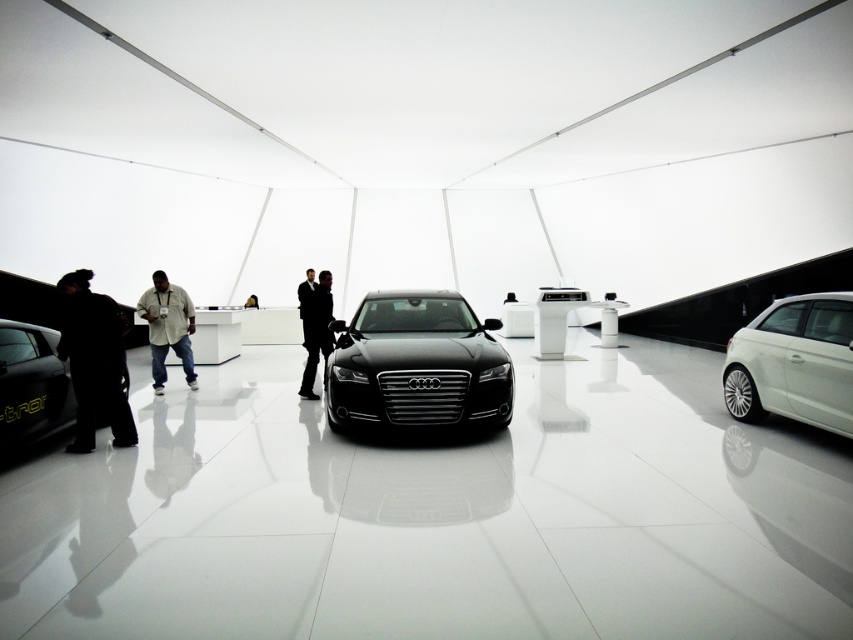
You are a delivery person trying to park your van in the showroom. The van requires a space that is at least 2 meters tall to accommodate its height. Based on the image, which car between the white metallic hatchback at right and the matte black car at lower left would you consider when assessing the available height for parking?

The white metallic hatchback at right has a greater height compared to the matte black car at lower left. Therefore, the available space above the white metallic hatchback at right would be lower, so you should consider the area near the matte black car at lower left for parking since it has a lower height and likely more vertical clearance.